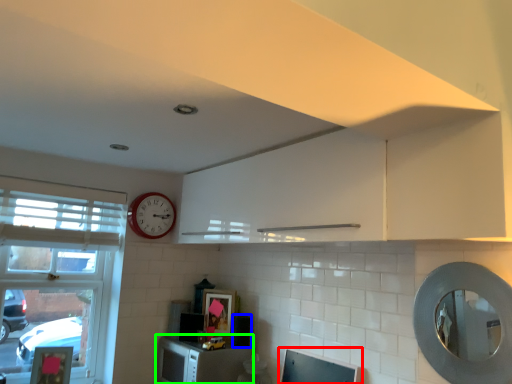
Question: Estimate the real-world distances between objects in this image. Which object is closer to computer monitor (highlighted by a red box), appliance (highlighted by a blue box) or cabinetry (highlighted by a green box)?

Choices:
 (A) appliance
 (B) cabinetry

Answer: (B)